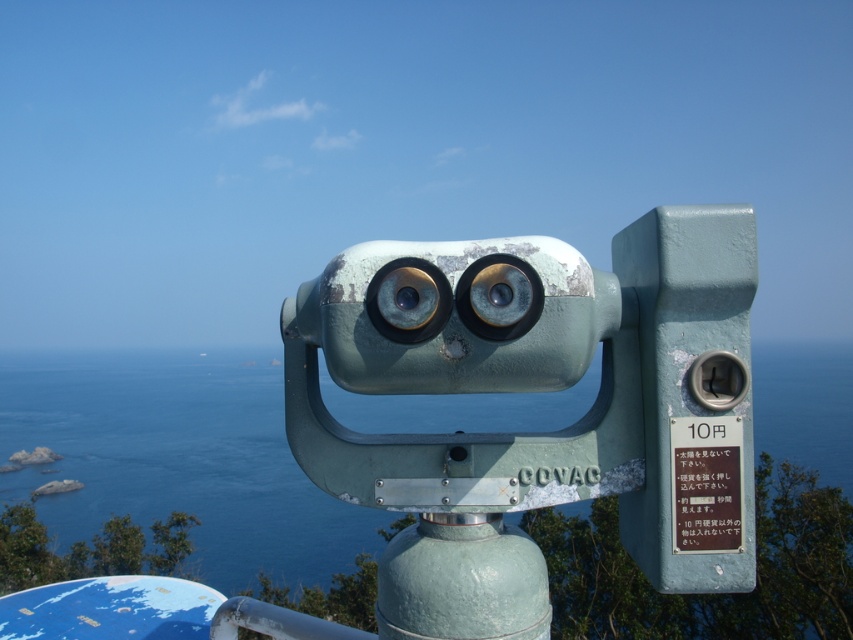
Can you confirm if green patina telescope at center is smaller than blue water at center?

Indeed, green patina telescope at center has a smaller size compared to blue water at center.

Is point (490, 244) more distant than point (1, 404)?

No.

You are a GUI agent. You are given a task and a screenshot of the screen. Output one action in this format:
    pyautogui.click(x=<x>, y=<y>)
    Task: Click on the green patina telescope at center
    Image resolution: width=853 pixels, height=640 pixels.
    Given the screenshot: What is the action you would take?
    pyautogui.click(x=538, y=388)